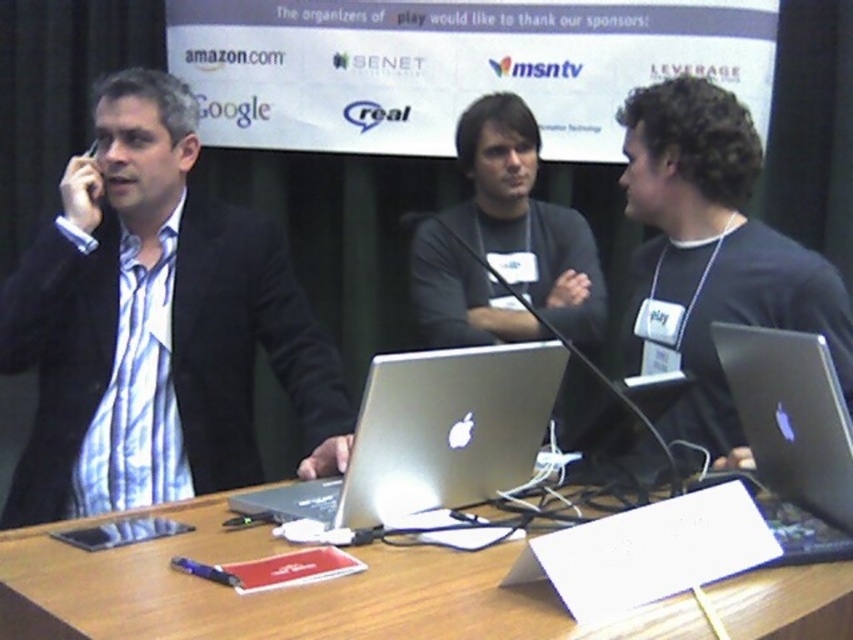
Question: Among these points, which one is nearest to the camera?

Choices:
 (A) 723,337
 (B) 289,330

Answer: (A)

Question: Does matte black suit at left come behind satin silver laptop at right?

Choices:
 (A) yes
 (B) no

Answer: (A)

Question: Based on their relative distances, which object is nearer to the wooden table at center?

Choices:
 (A) matte black suit at left
 (B) satin silver laptop at right
 (C) matte black laptop at right
 (D) silver metallic laptop at center

Answer: (D)

Question: Can you confirm if wooden table at center is wider than silver metallic laptop at center?

Choices:
 (A) no
 (B) yes

Answer: (B)

Question: Estimate the real-world distances between objects in this image. Which object is farther from the silver metallic laptop at center?

Choices:
 (A) satin silver laptop at right
 (B) matte black suit at left
 (C) wooden table at center
 (D) matte black laptop at right

Answer: (D)

Question: Is wooden table at center smaller than silver metallic laptop at center?

Choices:
 (A) no
 (B) yes

Answer: (A)